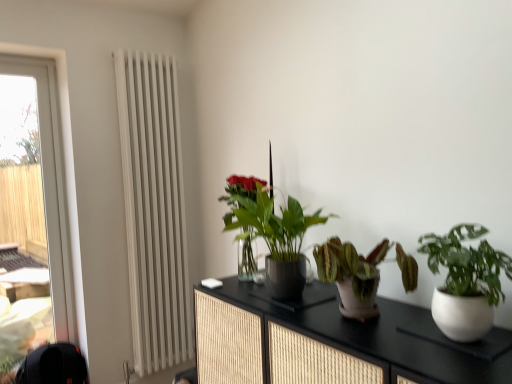
Question: Is black textured cabinet at center to the left of white metallic radiator at left from the viewer's perspective?

Choices:
 (A) no
 (B) yes

Answer: (A)

Question: Can you confirm if black textured cabinet at center is positioned to the right of white metallic radiator at left?

Choices:
 (A) yes
 (B) no

Answer: (A)

Question: Is black textured cabinet at center located outside white metallic radiator at left?

Choices:
 (A) yes
 (B) no

Answer: (A)

Question: From the image's perspective, is black textured cabinet at center on white metallic radiator at left?

Choices:
 (A) no
 (B) yes

Answer: (A)

Question: Could white metallic radiator at left be considered to be inside black textured cabinet at center?

Choices:
 (A) no
 (B) yes

Answer: (A)

Question: From the image's perspective, is transparent glass window at left located above or below green glossy plant at center, the fourth houseplant positioned from the front?

Choices:
 (A) above
 (B) below

Answer: (B)

Question: From their relative heights in the image, would you say transparent glass window at left is taller or shorter than green glossy plant at center, the fourth houseplant positioned from the front?

Choices:
 (A) short
 (B) tall

Answer: (B)

Question: Considering the positions of transparent glass window at left and green glossy plant at center, the fourth houseplant positioned from the front, in the image, is transparent glass window at left bigger or smaller than green glossy plant at center, the fourth houseplant positioned from the front,?

Choices:
 (A) big
 (B) small

Answer: (A)

Question: From a real-world perspective, is transparent glass window at left positioned above or below green glossy plant at center, the fourth houseplant positioned from the front?

Choices:
 (A) above
 (B) below

Answer: (A)

Question: Considering their positions, is leathery terracotta pot at center, placed as the 3th houseplant when sorted from back to front, located in front of or behind white matte pot at right, the 1th houseplant from the front?

Choices:
 (A) front
 (B) behind

Answer: (B)

Question: Is leathery terracotta pot at center, placed as the 3th houseplant when sorted from back to front, taller or shorter than white matte pot at right, the 1th houseplant from the front?

Choices:
 (A) tall
 (B) short

Answer: (B)

Question: Is leathery terracotta pot at center, placed as the 3th houseplant when sorted from back to front, wider or thinner than white matte pot at right, the 1th houseplant from the front?

Choices:
 (A) thin
 (B) wide

Answer: (B)

Question: Is leathery terracotta pot at center, the second houseplant positioned from the front, bigger or smaller than white matte pot at right, the 4th houseplant viewed from the back?

Choices:
 (A) big
 (B) small

Answer: (A)

Question: From a real-world perspective, relative to black textured cabinet at center, is leathery terracotta pot at center, the second houseplant positioned from the front, vertically above or below?

Choices:
 (A) below
 (B) above

Answer: (B)

Question: From the image's perspective, is leathery terracotta pot at center, placed as the 3th houseplant when sorted from back to front, positioned above or below black textured cabinet at center?

Choices:
 (A) below
 (B) above

Answer: (B)